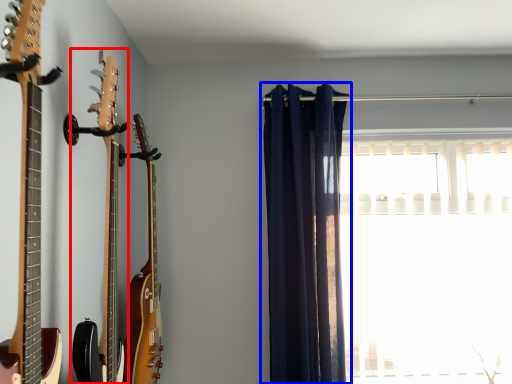
Question: Which point is further to the camera, guitar (highlighted by a red box) or curtain (highlighted by a blue box)?

Choices:
 (A) guitar
 (B) curtain

Answer: (B)